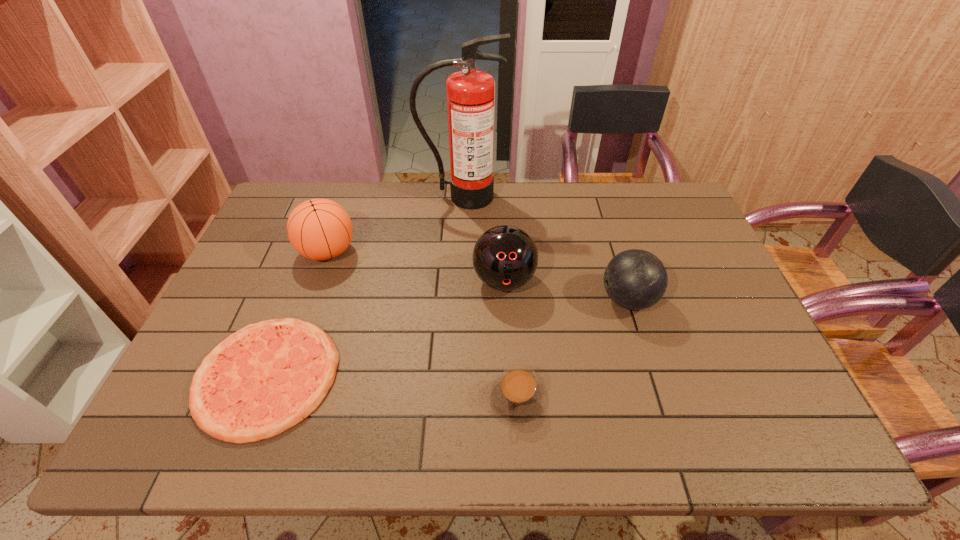
Where is `the tallest object`? Image resolution: width=960 pixels, height=540 pixels. the tallest object is located at coordinates (470, 93).

The width and height of the screenshot is (960, 540). Find the location of `the farthest object`. the farthest object is located at coordinates (470, 93).

You are a GUI agent. You are given a task and a screenshot of the screen. Output one action in this format:
    pyautogui.click(x=<x>, y=<y>)
    Task: Click on the left bowling ball
    Image resolution: width=960 pixels, height=540 pixels.
    Given the screenshot: What is the action you would take?
    pyautogui.click(x=505, y=258)

Locate an element on the screen. The width and height of the screenshot is (960, 540). basketball is located at coordinates (319, 229).

Locate an element on the screen. the rightmost object is located at coordinates (635, 279).

The width and height of the screenshot is (960, 540). I want to click on the second shortest object, so click(517, 395).

Image resolution: width=960 pixels, height=540 pixels. Find the location of `pizza`. pizza is located at coordinates [262, 380].

Find the location of a particular element. vacant space situated on the front-facing side of the farthest object is located at coordinates (457, 286).

Find the location of a particular element. Image resolution: width=960 pixels, height=540 pixels. vacant space located 0.330m on the surface of the left bowling ball near the finger holes is located at coordinates (511, 420).

Locate an element on the screen. The width and height of the screenshot is (960, 540). free region located on the right of the basketball is located at coordinates (420, 252).